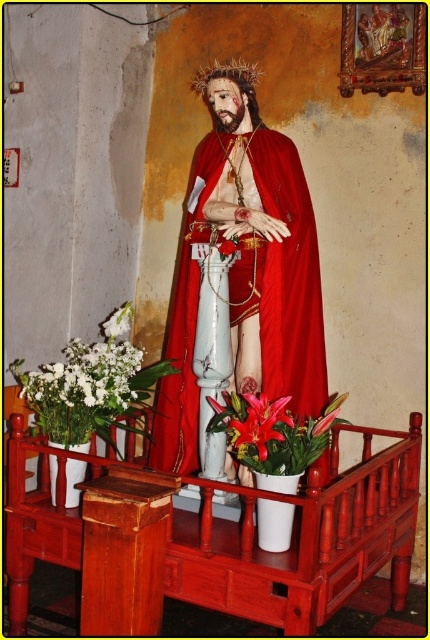
The image size is (430, 640). I want to click on wooden rail at center, so click(x=304, y=540).

Describe the element at coordinates (304, 540) in the screenshot. The image size is (430, 640). I see `wooden rail at center` at that location.

What are the coordinates of `wooden rail at center` in the screenshot? It's located at (304, 540).

What do you see at coordinates (273, 432) in the screenshot? I see `matte pink lilies at center` at bounding box center [273, 432].

Which is in front, point (270, 422) or point (328, 419)?

Point (270, 422)

Locate an element on the screen. This screenshot has height=640, width=430. matte pink lilies at center is located at coordinates (273, 432).

Is white matte flowers at lower left bigger than lustrous pink lily at center?

Yes.

Does white matte flowers at lower left appear on the left side of lustrous pink lily at center?

Correct, you'll find white matte flowers at lower left to the left of lustrous pink lily at center.

You are a GUI agent. You are given a task and a screenshot of the screen. Output one action in this format:
    pyautogui.click(x=<x>, y=<y>)
    Task: Click on the white matte flowers at lower left
    This screenshot has width=430, height=640.
    Given the screenshot: What is the action you would take?
    pyautogui.click(x=117, y=321)